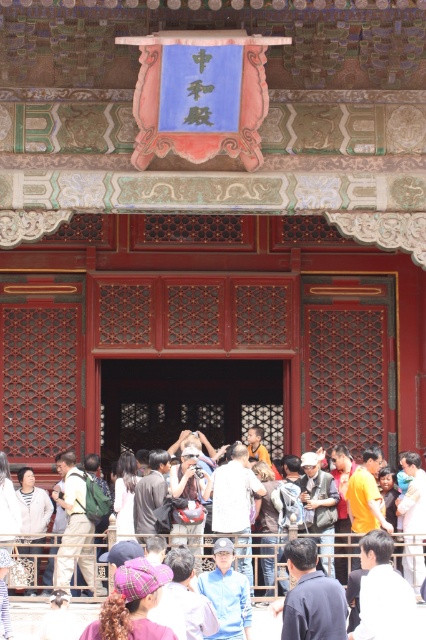
Question: Among these points, which one is farthest from the camera?

Choices:
 (A) (132, 454)
 (B) (166, 632)
 (C) (48, 520)

Answer: (A)

Question: Can you confirm if white fuzzy jacket at lower left is positioned below white cotton shirt at center?

Choices:
 (A) yes
 (B) no

Answer: (A)

Question: Which point is closer to the camera?

Choices:
 (A) (126, 481)
 (B) (141, 621)
 (C) (37, 547)

Answer: (B)

Question: Does white fuzzy jacket at lower left appear on the right side of white cotton shirt at center?

Choices:
 (A) yes
 (B) no

Answer: (B)

Question: Does plaid fabric headscarf at lower center have a greater width compared to white fuzzy jacket at lower left?

Choices:
 (A) yes
 (B) no

Answer: (A)

Question: Which object is positioned farthest from the plaid fabric headscarf at lower center?

Choices:
 (A) white fuzzy jacket at lower left
 (B) white cotton shirt at center

Answer: (A)